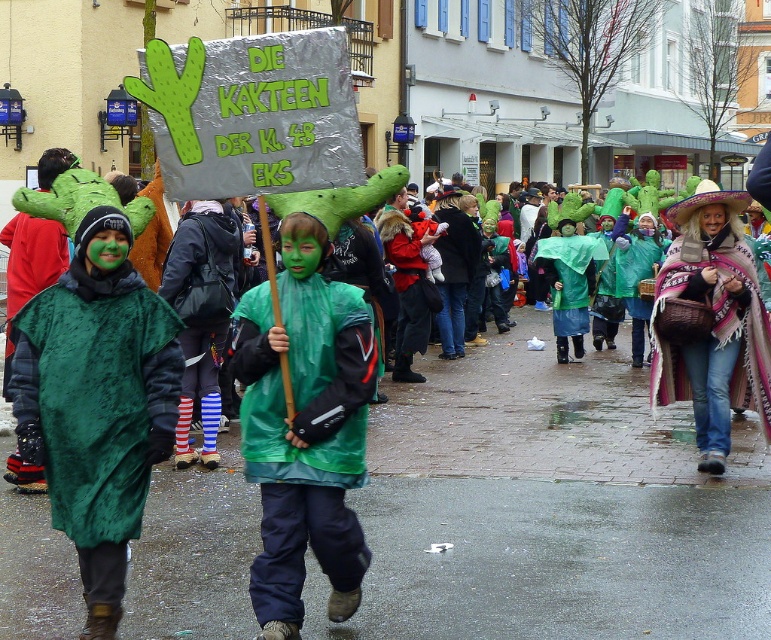
Question: Does velvet green cape at center have a greater width compared to rubber raincoat at center?

Choices:
 (A) yes
 (B) no

Answer: (B)

Question: Which of the following is the closest to the observer?

Choices:
 (A) velvet green cape at center
 (B) rubber raincoat at center
 (C) green shiny raincoat at center

Answer: (A)

Question: Is green shiny raincoat at center behind knitted woolen shawl at center?

Choices:
 (A) yes
 (B) no

Answer: (B)

Question: Among these points, which one is farthest from the camera?

Choices:
 (A) (605, 250)
 (B) (695, 256)
 (C) (332, 568)

Answer: (A)

Question: Among these points, which one is nearest to the camera?

Choices:
 (A) (12, 362)
 (B) (263, 570)
 (C) (756, 384)

Answer: (B)

Question: Is green shiny raincoat at center below rubber raincoat at center?

Choices:
 (A) no
 (B) yes

Answer: (B)